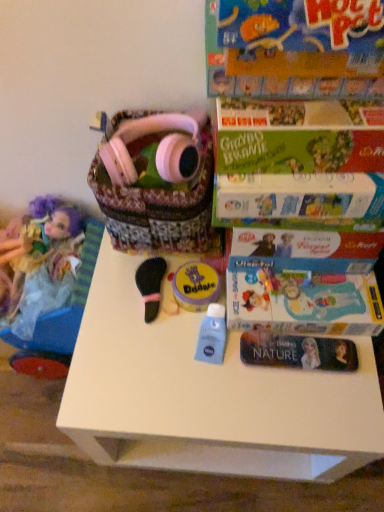
This screenshot has width=384, height=512. What are the coordinates of `vacant space situated on the left part of black felt brush at center, positioned as the second toy in right-to-left order` in the screenshot? It's located at [x=105, y=298].